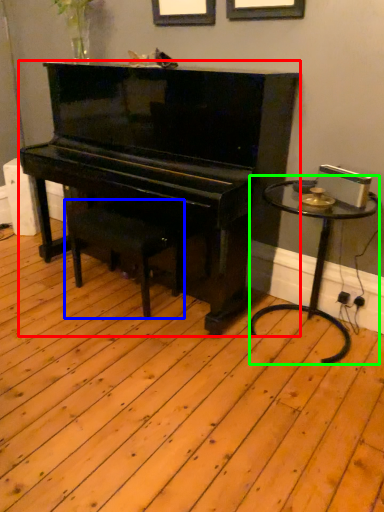
Question: Estimate the real-world distances between objects in this image. Which object is farther from piano (highlighted by a red box), music stool (highlighted by a blue box) or table (highlighted by a green box)?

Choices:
 (A) music stool
 (B) table

Answer: (B)